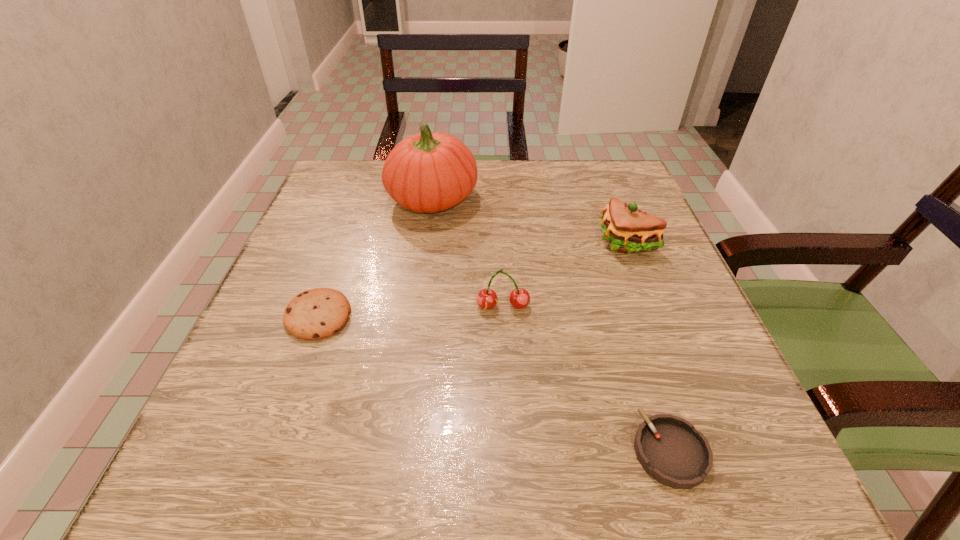
Find the location of a particular element. This screenshot has height=540, width=960. pumpkin is located at coordinates (429, 172).

You are a GUI agent. You are given a task and a screenshot of the screen. Output one action in this format:
    pyautogui.click(x=<x>, y=<y>)
    Task: Click on the sandwich
    Image resolution: width=960 pixels, height=540 pixels.
    Given the screenshot: What is the action you would take?
    pyautogui.click(x=627, y=229)

Locate an element on the screen. The image size is (960, 540). cherry is located at coordinates (519, 298).

Where is `the leftmost object`? the leftmost object is located at coordinates (318, 313).

The image size is (960, 540). Find the location of `ashtray`. ashtray is located at coordinates (669, 448).

In order to click on the shortest object in this screenshot , I will do `click(669, 448)`.

Locate an element on the screen. This screenshot has height=540, width=960. vacant space located 0.370m on the right of the tallest object is located at coordinates (633, 199).

Identify the location of free space located 0.280m on the front of the sandwich. The width and height of the screenshot is (960, 540). (680, 380).

Find the location of a particular element. vacant space located 0.090m with stems pointing upwards on the cherry is located at coordinates (506, 357).

Locate an element on the screen. The width and height of the screenshot is (960, 540). vacant space located on the back of the cookie is located at coordinates (364, 190).